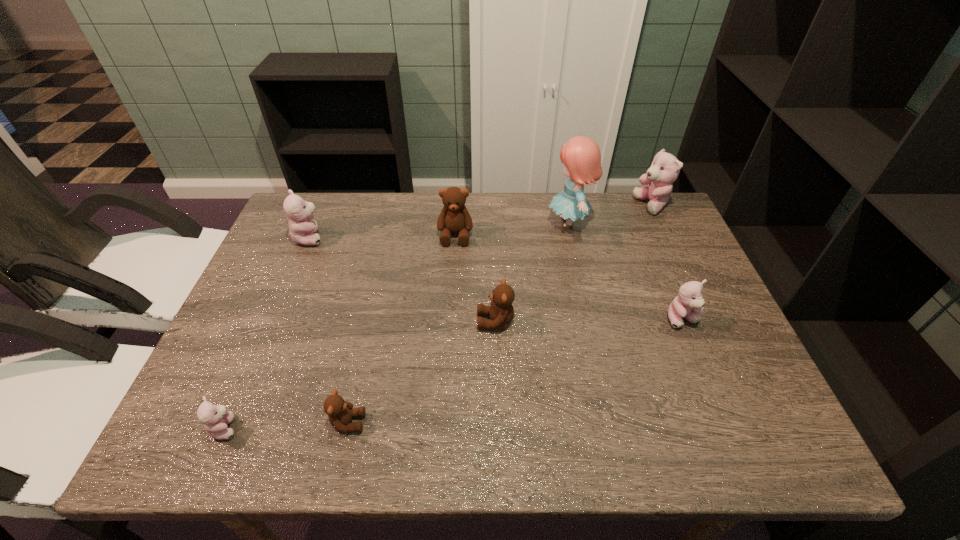
Find the location of a particular element. The image size is (960, 540). the nearest brown teddy bear is located at coordinates (340, 412).

The height and width of the screenshot is (540, 960). I want to click on the leftmost brown teddy bear, so click(340, 412).

Find the location of a particular element. The image size is (960, 540). the nearest pink teddy bear is located at coordinates (215, 418).

The width and height of the screenshot is (960, 540). I want to click on free spot located 0.360m on the front-facing side of the tallest object, so click(x=428, y=222).

I want to click on free space located on the front-facing side of the tallest object, so click(x=493, y=222).

You are a GUI agent. You are given a task and a screenshot of the screen. Output one action in this format:
    pyautogui.click(x=<x>, y=<y>)
    Task: Click on the vacant space located 0.090m on the front-facing side of the tallest object
    
    Given the screenshot: What is the action you would take?
    pyautogui.click(x=516, y=222)

The width and height of the screenshot is (960, 540). What are the coordinates of `vacant space located 0.390m at the face of the farthest teddy bear` in the screenshot? It's located at (512, 206).

Identify the location of vacant space located at the face of the farthest teddy bear. The width and height of the screenshot is (960, 540). (550, 206).

This screenshot has height=540, width=960. What are the coordinates of `free location located at the face of the farthest teddy bear` in the screenshot? It's located at (581, 206).

The width and height of the screenshot is (960, 540). In order to click on free location located at the face of the second biggest pink teddy bear in this screenshot , I will do `click(420, 238)`.